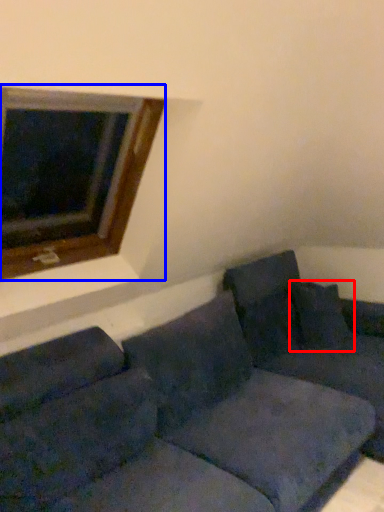
Question: Which object is closer to the camera taking this photo, pillow (highlighted by a red box) or window (highlighted by a blue box)?

Choices:
 (A) pillow
 (B) window

Answer: (B)